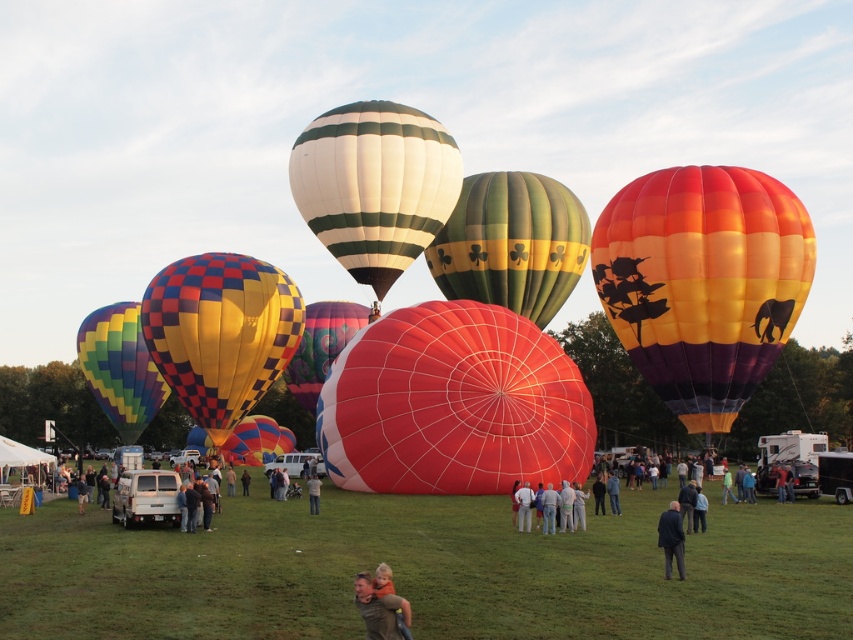
Question: Can you confirm if green grass at center is positioned to the right of dark blue suit at lower center?

Choices:
 (A) yes
 (B) no

Answer: (B)

Question: Is matte red balloon at center in front of light brown leather jacket at center?

Choices:
 (A) yes
 (B) no

Answer: (B)

Question: Is white striped balloon at center bigger than white fabric pants at center?

Choices:
 (A) no
 (B) yes

Answer: (B)

Question: Which point is closer to the camera?

Choices:
 (A) (404, 621)
 (B) (271, 320)

Answer: (A)

Question: Which of the following is the farthest from the observer?

Choices:
 (A) white striped balloon at center
 (B) green fabric shirt at center

Answer: (A)

Question: Which object appears closest to the camera in this image?

Choices:
 (A) dark blue suit at lower center
 (B) smooth skin man holding child at center
 (C) green fabric shirt at center
 (D) multicolored fabric balloon at left

Answer: (B)